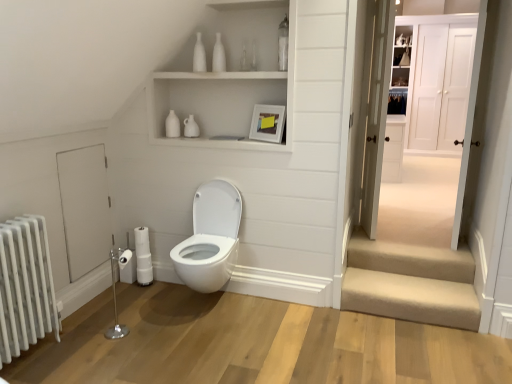
In order to click on free space to the back side of white wooden door at upper right, which is counted as the third door, starting from the front in this screenshot , I will do tap(407, 217).